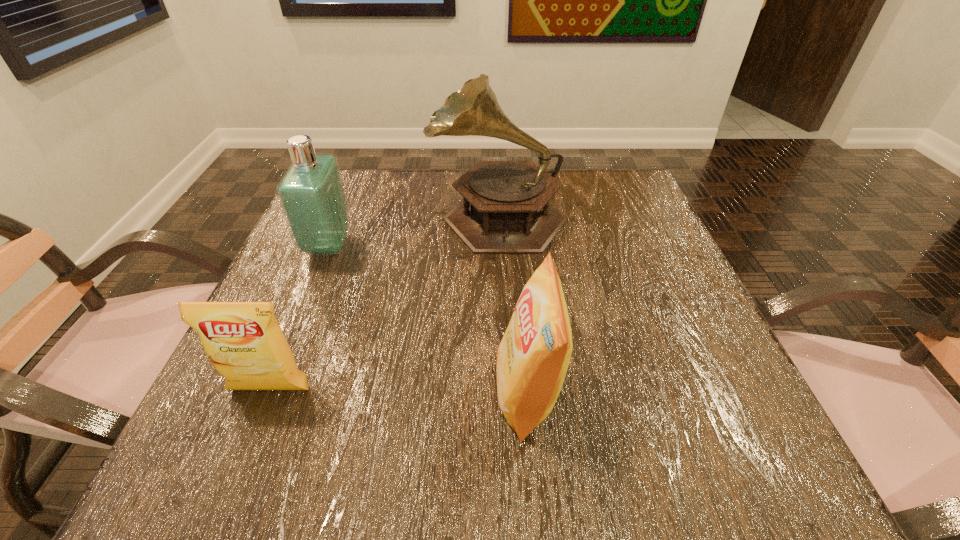
Where is `free space at the far left corner`? free space at the far left corner is located at coordinates (346, 193).

Locate an element on the screen. Image resolution: width=960 pixels, height=540 pixels. vacant space at the far right corner of the desktop is located at coordinates (605, 183).

This screenshot has height=540, width=960. Find the location of `vacant position at the near right corner of the desktop`. vacant position at the near right corner of the desktop is located at coordinates (707, 434).

Find the location of a particular element. Image resolution: width=960 pixels, height=540 pixels. vacant space that is in between the left crisp (potato chip) and the phonograph record is located at coordinates (384, 302).

You are a GUI agent. You are given a task and a screenshot of the screen. Output one action in this format:
    pyautogui.click(x=<x>, y=<y>)
    Task: Click on the unoccupied position between the right crisp (potato chip) and the left crisp (potato chip)
    The height and width of the screenshot is (540, 960).
    Given the screenshot: What is the action you would take?
    pyautogui.click(x=399, y=392)

The width and height of the screenshot is (960, 540). Find the location of `free space that is in between the perfume and the right crisp (potato chip)`. free space that is in between the perfume and the right crisp (potato chip) is located at coordinates (428, 320).

At what (x,y) coordinates should I click in order to perform the action: click on empty location between the left crisp (potato chip) and the right crisp (potato chip). Please return your answer as a coordinate pair (x, y). This screenshot has width=960, height=540. Looking at the image, I should click on (399, 392).

This screenshot has width=960, height=540. In order to click on vacant space that is in between the left crisp (potato chip) and the phonograph record in this screenshot , I will do `click(384, 302)`.

Locate an element on the screen. The height and width of the screenshot is (540, 960). free spot between the perfume and the left crisp (potato chip) is located at coordinates pyautogui.click(x=300, y=318).

You are a GUI agent. You are given a task and a screenshot of the screen. Output one action in this format:
    pyautogui.click(x=<x>, y=<y>)
    Task: Click on the free space between the perfume and the phonograph record
    
    Given the screenshot: What is the action you would take?
    pyautogui.click(x=413, y=231)